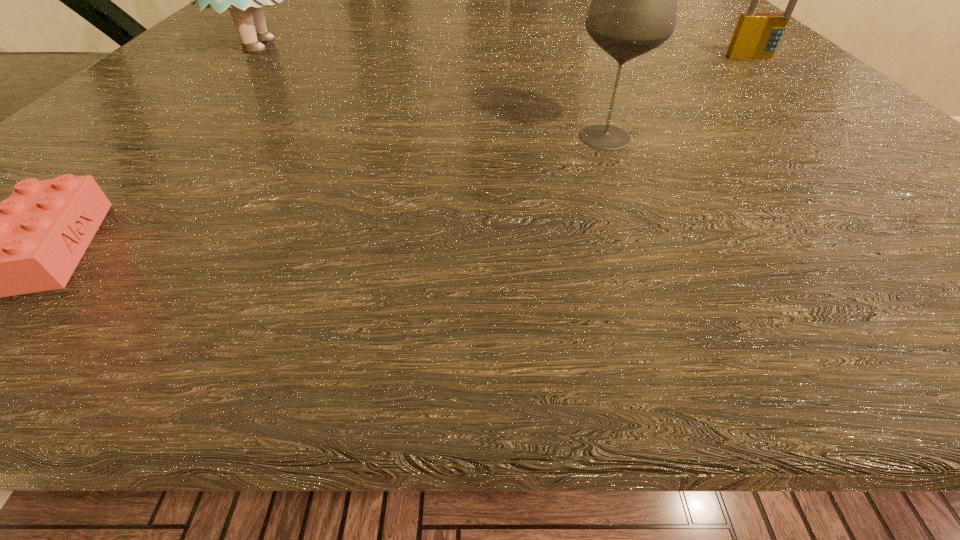
Where is `doll`? Image resolution: width=960 pixels, height=540 pixels. doll is located at coordinates (245, 0).

Locate an element on the screen. wineglass is located at coordinates (633, 10).

At what (x,y) coordinates should I click in order to perform the action: click on the third farthest object. Please return your answer as a coordinate pair (x, y). Looking at the image, I should click on (633, 10).

This screenshot has width=960, height=540. In order to click on padlock in this screenshot , I will do `click(757, 35)`.

What are the coordinates of `the rightmost object` in the screenshot? It's located at (757, 35).

The image size is (960, 540). Identify the location of blank area located on the front-facing side of the tallest object. (471, 46).

Where is `vacant region located on the front of the wineglass`? Image resolution: width=960 pixels, height=540 pixels. vacant region located on the front of the wineglass is located at coordinates (636, 217).

The image size is (960, 540). What are the coordinates of `vacant space situated 0.250m on the side with the combination dials of the padlock` in the screenshot? It's located at (882, 174).

This screenshot has height=540, width=960. Identify the location of object present at the left edge. (245, 0).

In order to click on object that is at the right edge in this screenshot , I will do `click(757, 35)`.